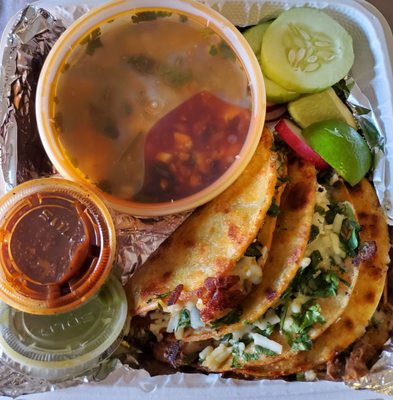
Locate an element on the screen. plastic container is located at coordinates (173, 133).